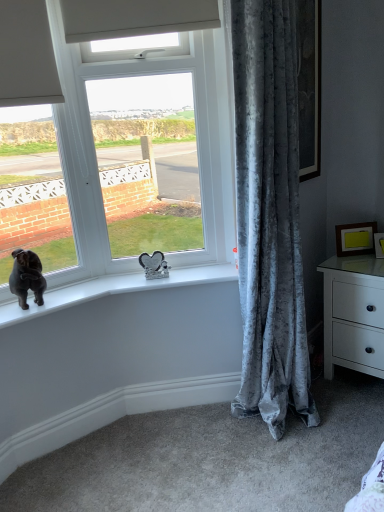
Find the location of `free space in front of yellow matte picture frame at upper right, which ranks as the 2th picture frame in right-to-left order`. free space in front of yellow matte picture frame at upper right, which ranks as the 2th picture frame in right-to-left order is located at coordinates (364, 263).